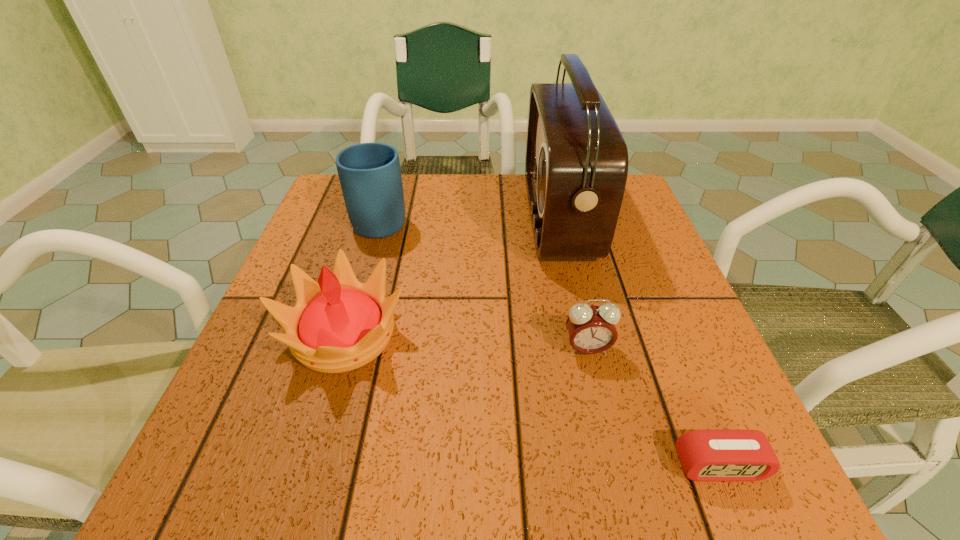
Identify the location of radio receiver. (576, 164).

You are a GUI agent. You are given a task and a screenshot of the screen. Output one action in this format:
    pyautogui.click(x=<x>, y=<y>)
    Task: Click on the mug
    This screenshot has width=960, height=540.
    Given the screenshot: What is the action you would take?
    pyautogui.click(x=370, y=177)

Locate an element on the screen. This screenshot has height=540, width=960. crown is located at coordinates (339, 324).

At what (x,y) coordinates should I click in order to perform the action: click on the fourth tallest object. Please return your answer as a coordinate pair (x, y). The height and width of the screenshot is (540, 960). Looking at the image, I should click on (591, 329).

The height and width of the screenshot is (540, 960). What are the coordinates of `the taller alarm clock` in the screenshot? It's located at (591, 329).

Locate an element on the screen. This screenshot has width=960, height=540. the shortest object is located at coordinates (706, 455).

This screenshot has width=960, height=540. I want to click on the nearest object, so click(x=706, y=455).

You are a GUI agent. You are given a task and a screenshot of the screen. Output one action in this format:
    pyautogui.click(x=<x>, y=<y>)
    Task: Click on the free space located 0.050m on the front panel of the tallest object
    
    Given the screenshot: What is the action you would take?
    pyautogui.click(x=507, y=217)

Identify the location of blank area located on the front panel of the tallest object. (451, 217).

Locate an element on the screen. The height and width of the screenshot is (540, 960). free location located on the front panel of the tallest object is located at coordinates (421, 217).